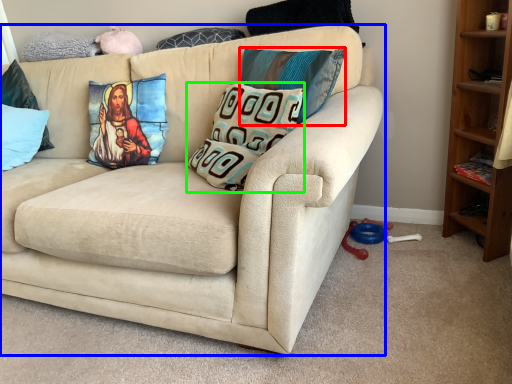
Question: Considering the real-world distances, which object is farthest from pillow (highlighted by a red box)? studio couch (highlighted by a blue box) or pillow (highlighted by a green box)?

Choices:
 (A) studio couch
 (B) pillow

Answer: (A)